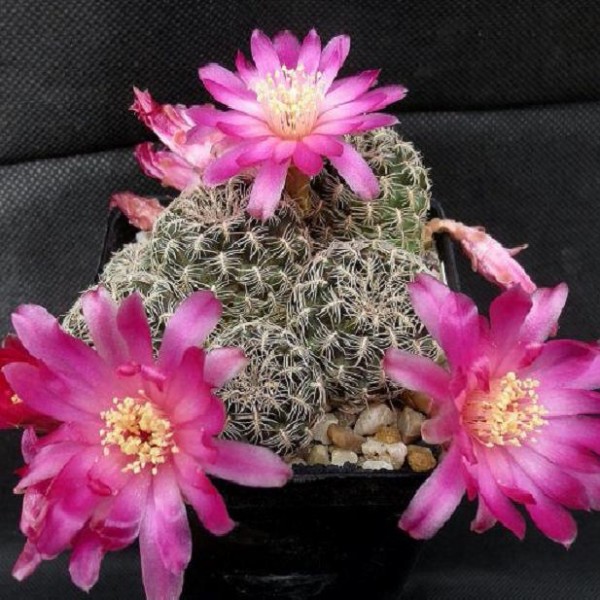
I want to click on planter, so click(x=110, y=231).